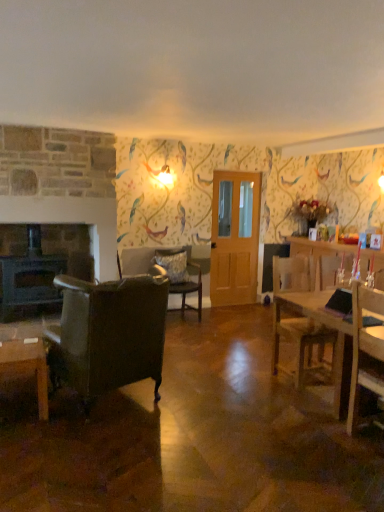
Question: Considering the relative sizes of wooden table at right and clear glass door at center in the image provided, is wooden table at right bigger than clear glass door at center?

Choices:
 (A) yes
 (B) no

Answer: (A)

Question: Considering the relative positions of wooden table at right and clear glass door at center in the image provided, is wooden table at right to the left of clear glass door at center from the viewer's perspective?

Choices:
 (A) no
 (B) yes

Answer: (A)

Question: Can you confirm if wooden table at right is smaller than clear glass door at center?

Choices:
 (A) no
 (B) yes

Answer: (A)

Question: Is wooden table at right placed right next to clear glass door at center?

Choices:
 (A) yes
 (B) no

Answer: (B)

Question: From the image's perspective, is wooden table at right located above clear glass door at center?

Choices:
 (A) yes
 (B) no

Answer: (B)

Question: Based on their sizes in the image, would you say fluffy gray pillow at center is bigger or smaller than green leafy plant at right?

Choices:
 (A) big
 (B) small

Answer: (B)

Question: Is fluffy gray pillow at center taller or shorter than green leafy plant at right?

Choices:
 (A) short
 (B) tall

Answer: (A)

Question: Is fluffy gray pillow at center in front of or behind green leafy plant at right in the image?

Choices:
 (A) front
 (B) behind

Answer: (A)

Question: From a real-world perspective, is fluffy gray pillow at center positioned above or below green leafy plant at right?

Choices:
 (A) above
 (B) below

Answer: (B)

Question: In terms of width, does dark gray stone fireplace at left look wider or thinner when compared to green leafy plant at right?

Choices:
 (A) wide
 (B) thin

Answer: (B)

Question: Would you say dark gray stone fireplace at left is to the left or to the right of green leafy plant at right in the picture?

Choices:
 (A) left
 (B) right

Answer: (A)

Question: From the image's perspective, is dark gray stone fireplace at left located above or below green leafy plant at right?

Choices:
 (A) below
 (B) above

Answer: (A)

Question: Choose the correct answer: Is dark gray stone fireplace at left inside green leafy plant at right or outside it?

Choices:
 (A) outside
 (B) inside

Answer: (A)

Question: Is dark gray stone fireplace at left taller or shorter than fluffy gray pillow at center?

Choices:
 (A) tall
 (B) short

Answer: (A)

Question: Is dark gray stone fireplace at left in front of or behind fluffy gray pillow at center in the image?

Choices:
 (A) front
 (B) behind

Answer: (A)